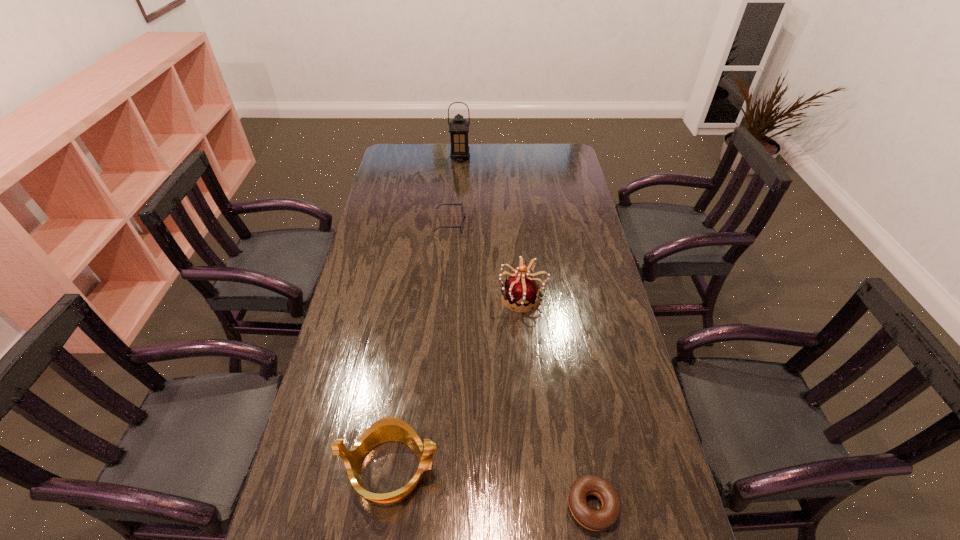
This screenshot has height=540, width=960. Identify the location of vacant space in between the spectacles and the doughnut. (521, 365).

Locate an element on the screen. blank region between the second farthest object and the doughnut is located at coordinates (521, 365).

Find the location of a particular element. object identified as the closest to the tallest object is located at coordinates (463, 215).

Locate which object ranks fourth in proximity to the third shortest object. Please provide its 2D coordinates. Your answer should be formatted as a tuple, i.e. [(x, y)], where the tuple contains the x and y coordinates of a point satisfying the conditions above.

[(458, 128)]

You are a GUI agent. You are given a task and a screenshot of the screen. Output one action in this format:
    pyautogui.click(x=<x>, y=<y>)
    Task: Click on the free space in the image that satisfies the following two spatial constraints: 1. on the front-facing side of the second tallest object; 2. on the right side of the doughnut
    The image size is (960, 540).
    Given the screenshot: What is the action you would take?
    pyautogui.click(x=542, y=506)

Identify the location of vacant space that satisfies the following two spatial constraints: 1. on the front-facing side of the doughnut; 2. on the left side of the farther tiara. This screenshot has height=540, width=960. (542, 506).

Identify the location of vacant point that satisfies the following two spatial constraints: 1. on the front side of the farthest object; 2. at the front emblem of the shorter tiara. (442, 468).

Where is `free space that satisfies the following two spatial constraints: 1. on the front-facing side of the third nearest object; 2. on the right side of the doughnut`? The image size is (960, 540). free space that satisfies the following two spatial constraints: 1. on the front-facing side of the third nearest object; 2. on the right side of the doughnut is located at coordinates (542, 506).

Find the location of a particular element. Image resolution: width=960 pixels, height=540 pixels. vacant region that satisfies the following two spatial constraints: 1. on the front side of the tallest object; 2. on the front-facing side of the spectacles is located at coordinates (456, 224).

The width and height of the screenshot is (960, 540). In order to click on vacant space that satisfies the following two spatial constraints: 1. at the front emblem of the left tiara; 2. on the left side of the doughnut in this screenshot , I will do `click(386, 506)`.